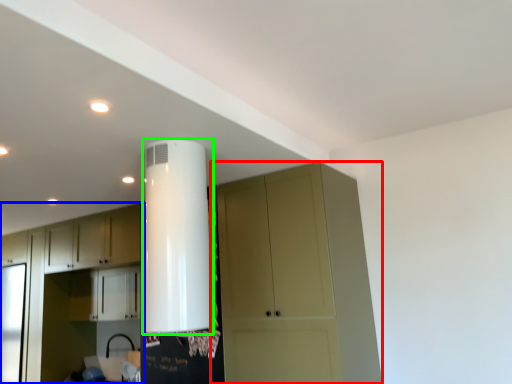
Question: Which is farther away from cupboard (highlighted by a red box)? cabinetry (highlighted by a blue box) or water heater (highlighted by a green box)?

Choices:
 (A) cabinetry
 (B) water heater

Answer: (A)